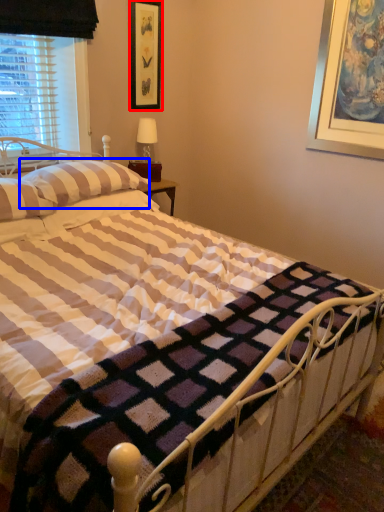
Question: Which object is further to the camera taking this photo, picture frame (highlighted by a red box) or pillow (highlighted by a blue box)?

Choices:
 (A) picture frame
 (B) pillow

Answer: (A)